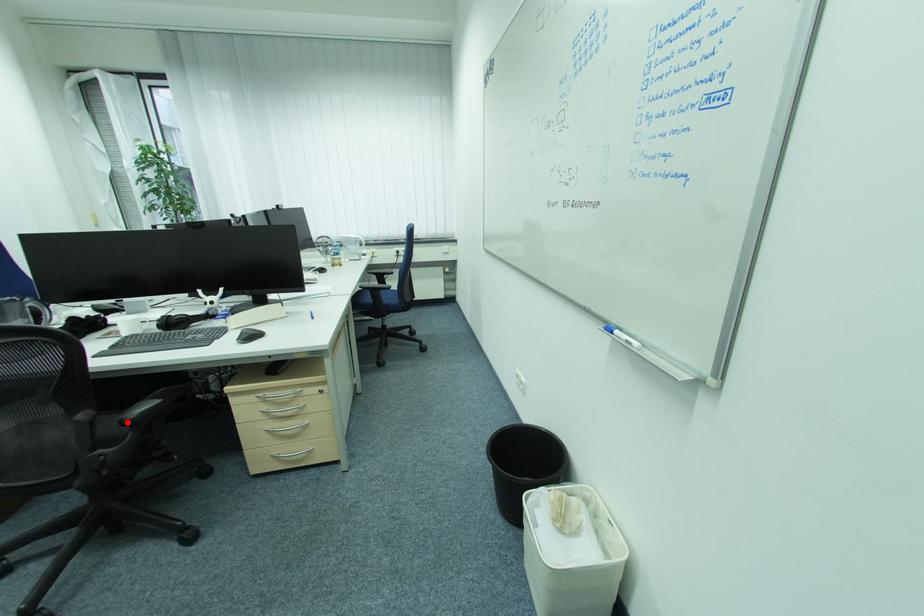
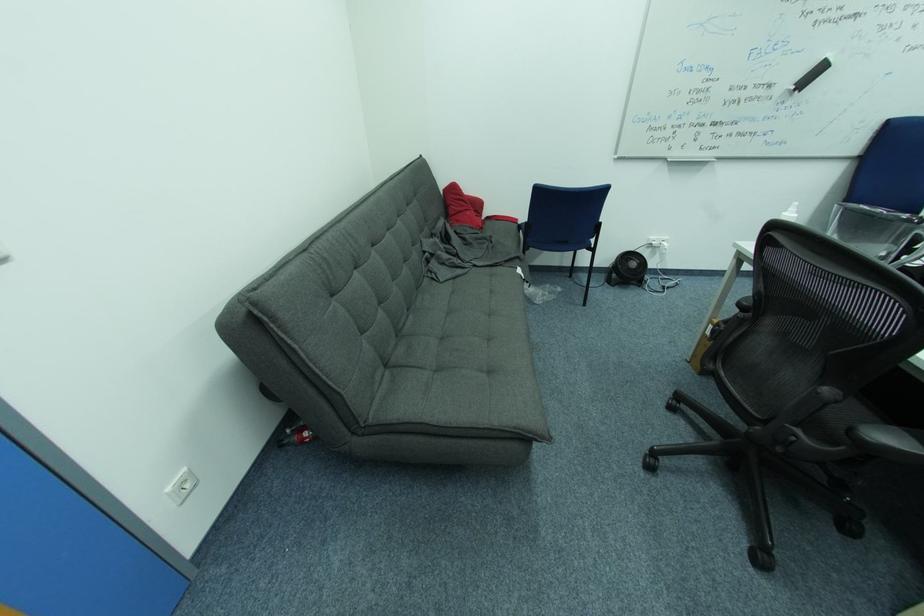
Where in the second image is the point corresponding to the highlighted location from the first image?

(858, 430)